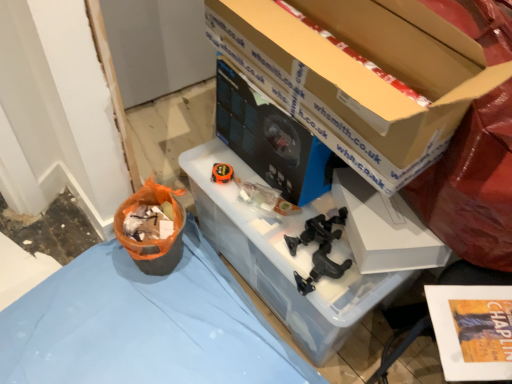
The image size is (512, 384). I want to click on free point behind orange rubber tape measure at center, the 2th toy positioned from the bottom, so click(x=219, y=156).